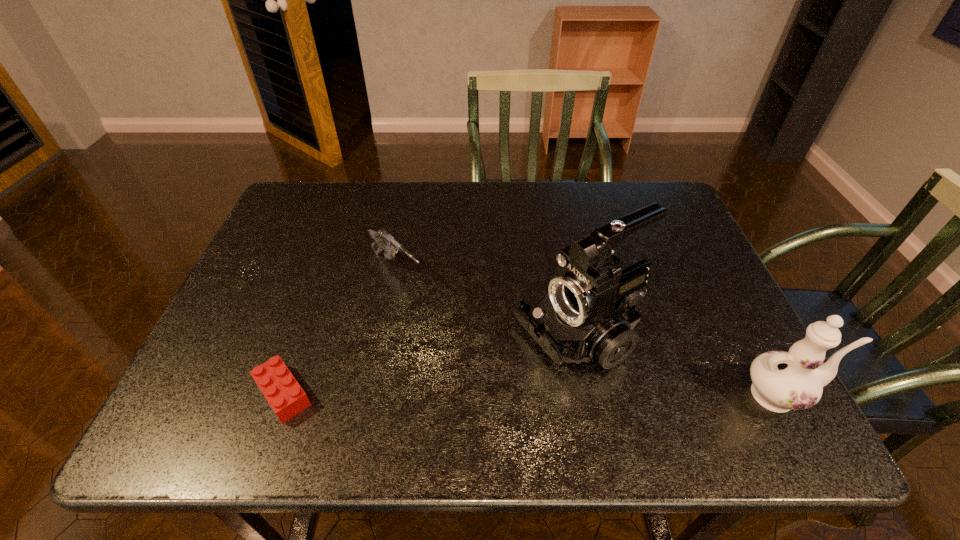
Find the location of a particular element. The height and width of the screenshot is (540, 960). free spot on the desktop that is between the Lego and the rightmost object and is positioned at the barrel of the gun is located at coordinates (537, 395).

Identify the location of vacant space on the desktop that is between the shortest object and the second tallest object and is positioned on the lens mount of the tallest object. (468, 394).